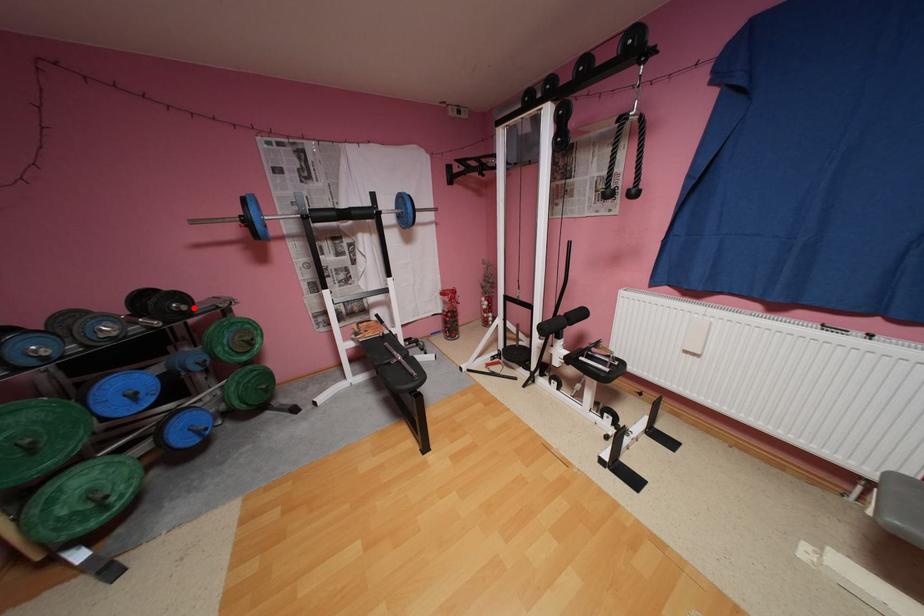
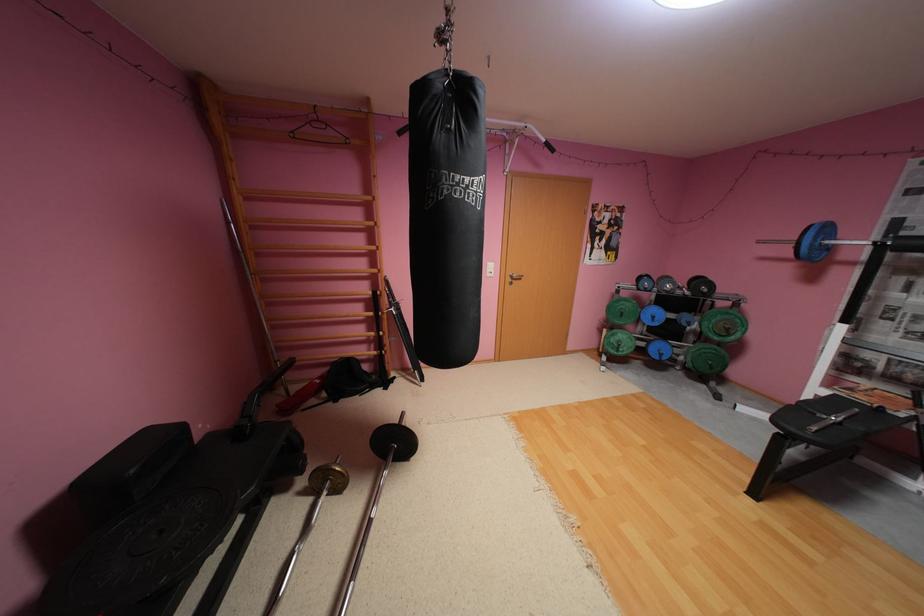
Where in the second image is the point corresponding to the highlighted location from the first image?

(714, 291)